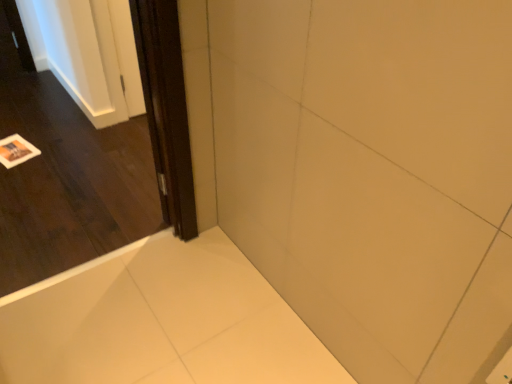
At what (x,y) coordinates should I click in order to perform the action: click on blank space situated above white glossy bathtub at lower left (from a real-world perspective). Please return your answer as a coordinate pair (x, y). The width and height of the screenshot is (512, 384). Looking at the image, I should click on (161, 317).